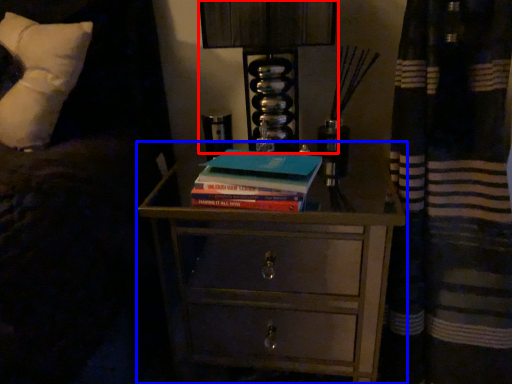
Question: Which point is further to the camera, bedside lamp (highlighted by a red box) or chest of drawers (highlighted by a blue box)?

Choices:
 (A) bedside lamp
 (B) chest of drawers

Answer: (A)